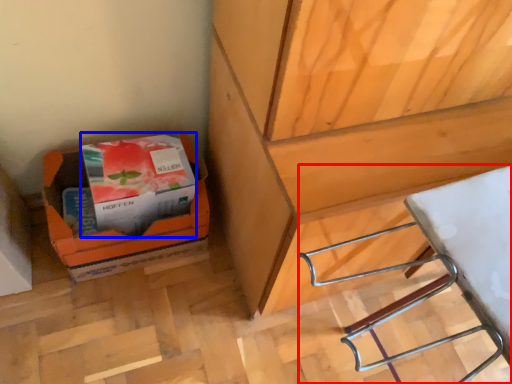
Question: Among these objects, which one is farthest to the camera, wood (highlighted by a red box) or paperback book (highlighted by a blue box)?

Choices:
 (A) wood
 (B) paperback book

Answer: (B)